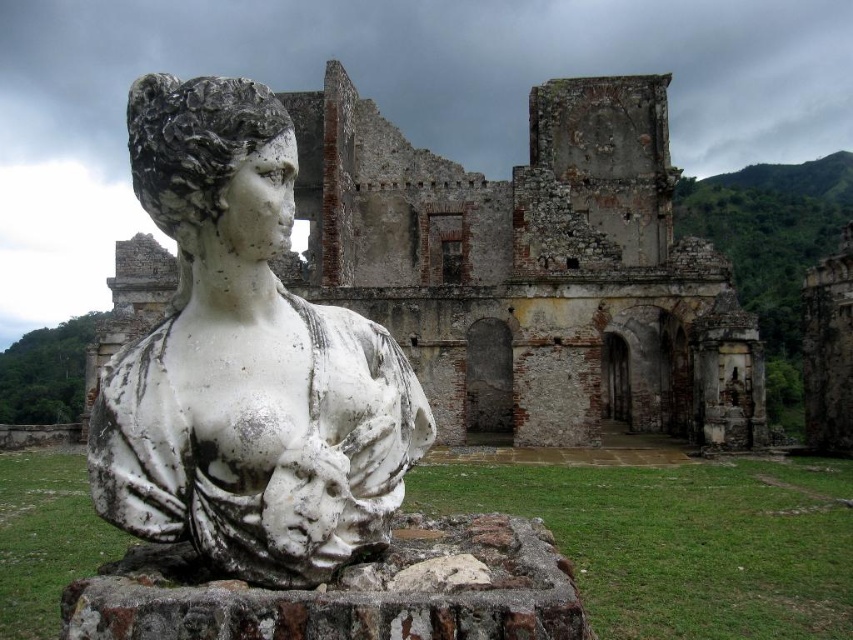
Question: Which point is farther from the camera taking this photo?

Choices:
 (A) (614, 225)
 (B) (172, 460)

Answer: (A)

Question: Can you confirm if weathered stone ruins at center is smaller than white marble bust at center?

Choices:
 (A) no
 (B) yes

Answer: (A)

Question: Which of the following is the closest to the observer?

Choices:
 (A) (325, 180)
 (B) (264, 561)

Answer: (B)

Question: Is weathered stone ruins at center closer to the viewer compared to white marble bust at center?

Choices:
 (A) no
 (B) yes

Answer: (A)

Question: Is weathered stone ruins at center positioned before white marble bust at center?

Choices:
 (A) yes
 (B) no

Answer: (B)

Question: Which object is closer to the camera taking this photo?

Choices:
 (A) weathered stone ruins at center
 (B) white marble bust at center

Answer: (B)